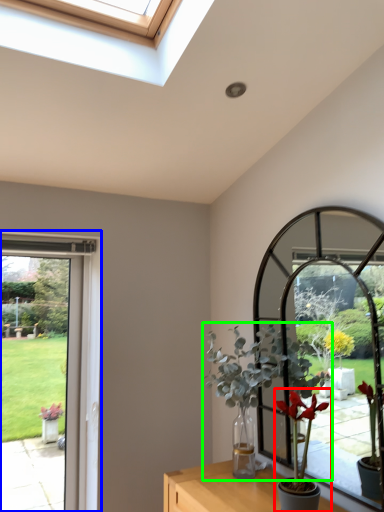
Question: Which object is the closest to the houseplant (highlighted by a red box)? Choose among these: window frame (highlighted by a blue box) or houseplant (highlighted by a green box).

Choices:
 (A) window frame
 (B) houseplant

Answer: (B)